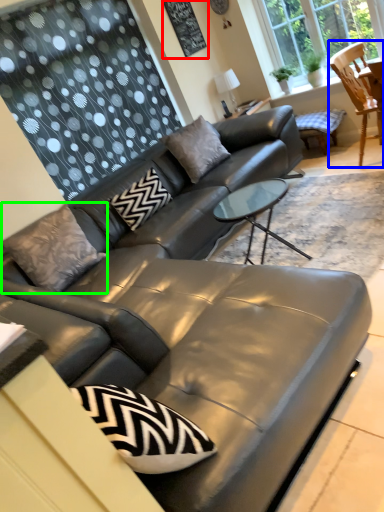
Question: Which object is the closest to the bulletin board (highlighted by a red box)? Choose among these: chair (highlighted by a blue box) or pillow (highlighted by a green box).

Choices:
 (A) chair
 (B) pillow

Answer: (A)